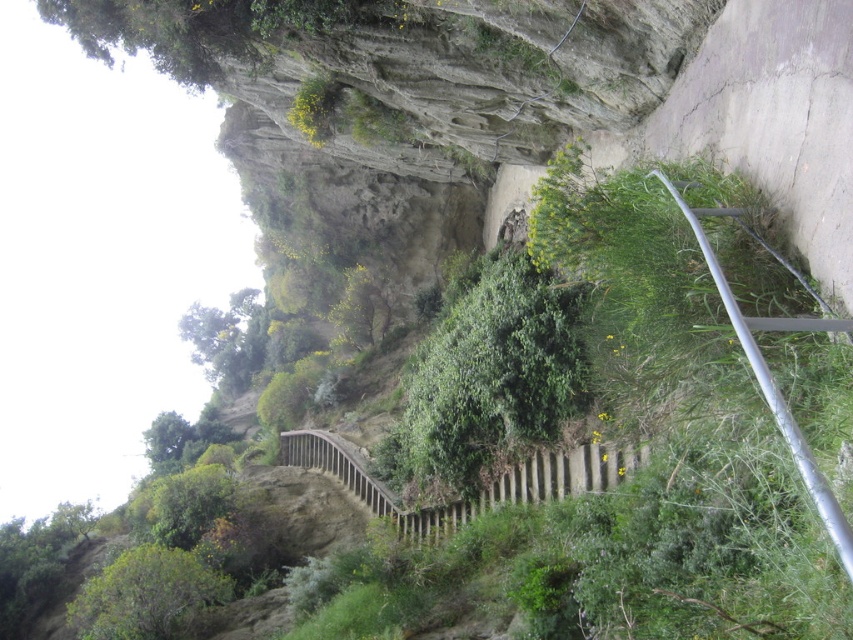
You are a hiker carrying a backpack and need to navigate the steep rocky terrain. You see the green leafy bush at center and the brown wooden rail at center. Can you safely reach the rail without stepping on the bush?

The green leafy bush at center is 9.45 feet away from the brown wooden rail at center. Since the distance is sufficient, you can safely reach the rail without stepping on the bush.

You are a hiker trying to navigate the steep rocky terrain. You see a green leafy bush at center and a silver metallic rail at right. Which object is closer to you as you climb the staircase?

The green leafy bush at center is closer to you than the silver metallic rail at right because it is further to the viewer, meaning it appears nearer in your line of sight.